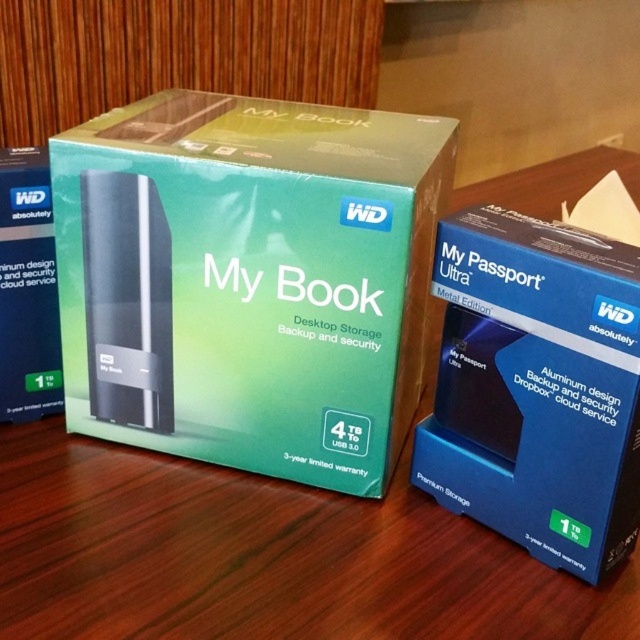
You are setting up a display for a tech store. You have two hard drives to arrange on a shelf. The blue aluminum my passport ultra at right and the matte black hard drive at left. According to the packaging size, which one should you place first if you want the larger one to be in the center of the shelf?

The blue aluminum my passport ultra at right is larger than the matte black hard drive at left. To place the larger one in the center, you should position the blue aluminum my passport ultra at right first in the center of the shelf.

You are a delivery person who needs to place a new package on the wooden surface where the two Western Digital external hard drive packaging boxes are located. The new package must be placed exactly between the two existing boxes. Given the coordinates of the blue aluminum my passport ultra at right, can you determine where to place the new package?

The blue aluminum my passport ultra at right is at point (x=536, y=387). To place the new package exactly between the two boxes, you need the coordinates of both boxes. However, the position of the box on the left is not provided. Without this information, it is impossible to determine the exact midpoint between them.